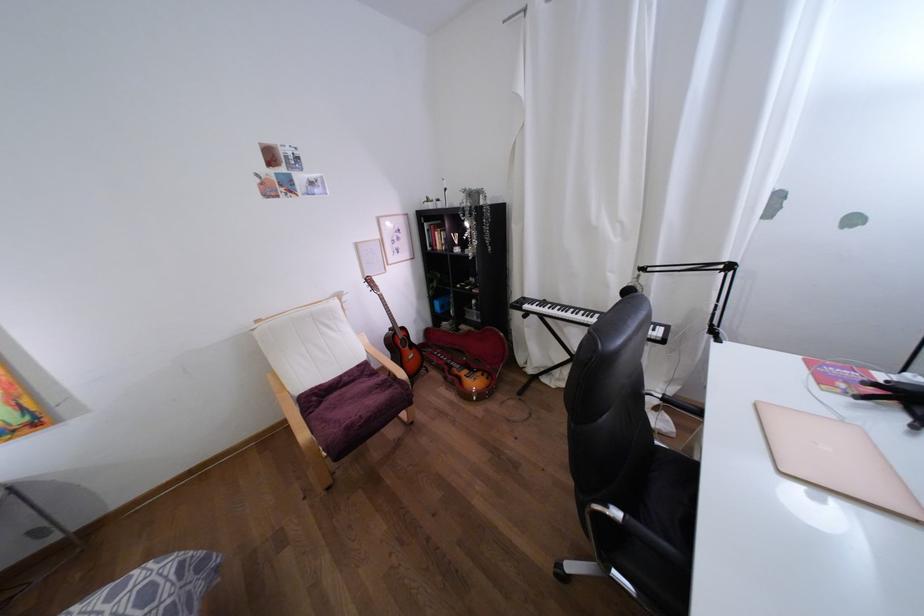
Which object does [714,333] point to?

It refers to a black microphone.